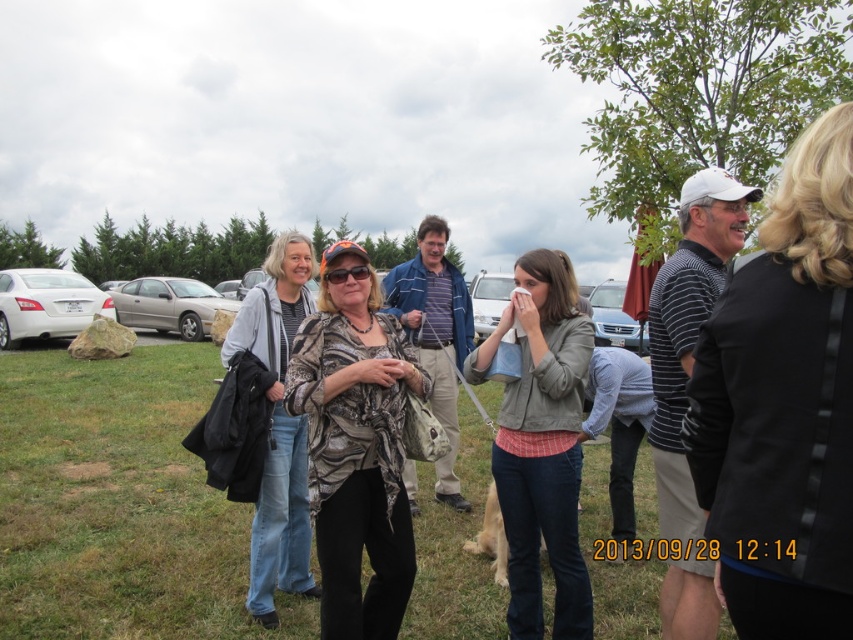
Question: Does gold metallic sedan at left appear over silver metallic sedan at center?

Choices:
 (A) yes
 (B) no

Answer: (A)

Question: Can you confirm if camouflage fabric shirt at center is positioned to the right of camouflage-patterned jacket at center?

Choices:
 (A) yes
 (B) no

Answer: (A)

Question: Can you confirm if camouflage fabric shirt at center is positioned to the right of camouflage-patterned jacket at center?

Choices:
 (A) no
 (B) yes

Answer: (B)

Question: Which object is positioned closest to the gold metallic sedan at left?

Choices:
 (A) white glossy sedan at left
 (B) green grass at center

Answer: (A)

Question: Considering the real-world distances, which object is closest to the green grass at center?

Choices:
 (A) camouflage fabric shirt at center
 (B) white glossy sedan at left

Answer: (A)

Question: Which point is closer to the camera taking this photo?

Choices:
 (A) (354, 244)
 (B) (61, 282)
 (C) (132, 307)
 (D) (537, 282)

Answer: (A)